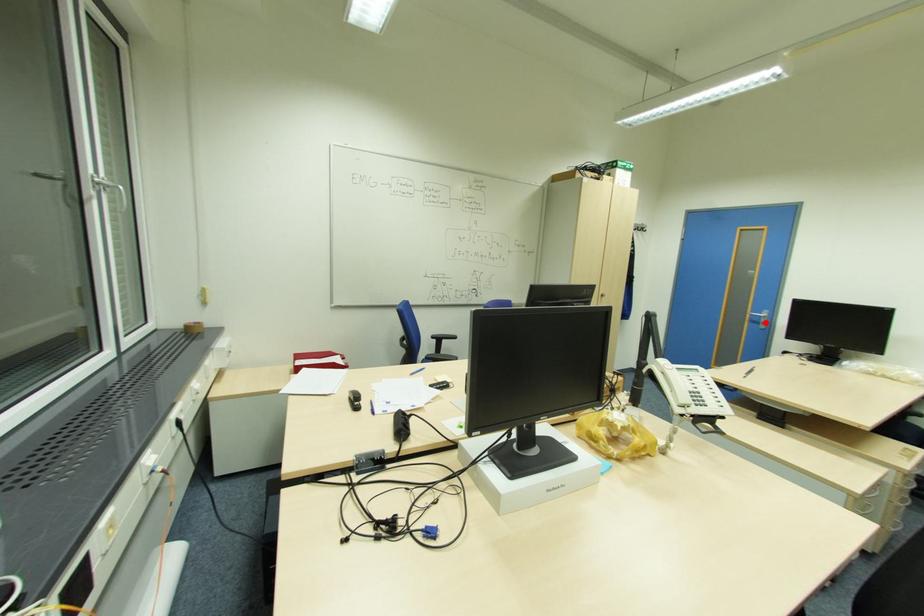
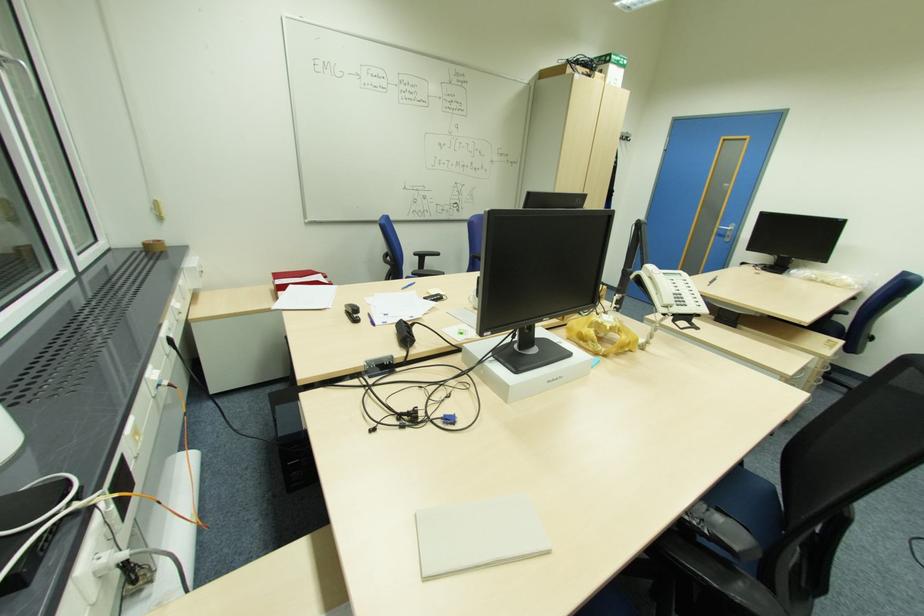
In the second image, find the point that corresponds to the highlighted location in the first image.

(732, 236)